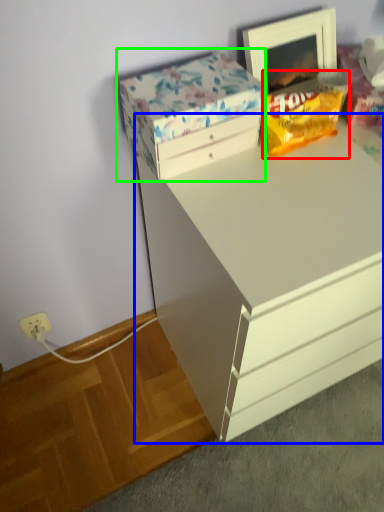
Question: Which is farther away from snack (highlighted by a red box)? chest of drawers (highlighted by a blue box) or storage box (highlighted by a green box)?

Choices:
 (A) chest of drawers
 (B) storage box

Answer: (A)